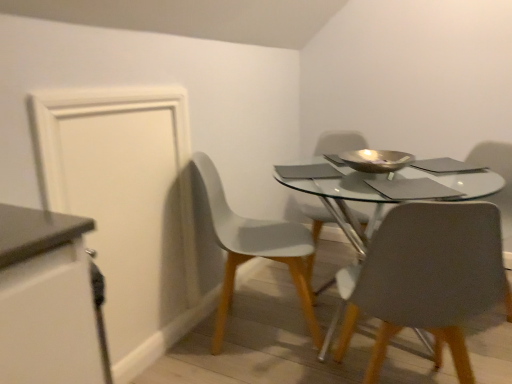
What do you see at coordinates (254, 249) in the screenshot?
I see `white matte chair at lower left, which appears as the second chair when viewed from the back` at bounding box center [254, 249].

Describe the element at coordinates (46, 300) in the screenshot. Image resolution: width=512 pixels, height=384 pixels. I see `white matte cabinet at left` at that location.

This screenshot has width=512, height=384. I want to click on white matte cabinet at left, so [46, 300].

Identify the location of white matte door at left. This screenshot has height=384, width=512. (125, 201).

Describe the element at coordinates (125, 201) in the screenshot. Image resolution: width=512 pixels, height=384 pixels. I see `white matte door at left` at that location.

Find the location of a particular element. The image size is (512, 384). metallic gold bowl at center is located at coordinates (376, 160).

Which of these two, white matte chair at lower left, the second chair when ordered from front to back, or white matte cabinet at left, is bigger?

white matte chair at lower left, the second chair when ordered from front to back.

Could you tell me if white matte chair at lower left, the second chair when ordered from front to back, is turned towards white matte cabinet at left?

No, white matte chair at lower left, the second chair when ordered from front to back, is not turned towards white matte cabinet at left.

Consider the image. Is white matte chair at lower left, which appears as the second chair when viewed from the back, wider or thinner than white matte cabinet at left?

Considering their sizes, white matte chair at lower left, which appears as the second chair when viewed from the back, looks broader than white matte cabinet at left.

In terms of size, does white matte door at left appear bigger or smaller than matte gray chair at center, the 1th chair viewed from the front?

white matte door at left is smaller than matte gray chair at center, the 1th chair viewed from the front.

Is white matte door at left completely or partially outside of matte gray chair at center, the 1th chair viewed from the front?

Yes, white matte door at left is outside of matte gray chair at center, the 1th chair viewed from the front.

From the image's perspective, starting from the white matte door at left, which chair is the 2nd one below? Please provide its 2D coordinates.

[(429, 278)]

From a real-world perspective, is white matte door at left located higher than matte gray chair at center, the 1th chair viewed from the front?

Yes, from a real-world perspective, white matte door at left is over matte gray chair at center, the 1th chair viewed from the front

Which point is more forward, (383, 171) or (219, 245)?

The point (383, 171) is in front.

Who is smaller, metallic gold bowl at center or white matte chair at lower left, the second chair when ordered from front to back?

Smaller between the two is metallic gold bowl at center.

Which of these two, metallic gold bowl at center or white matte chair at lower left, the second chair when ordered from front to back, is thinner?

metallic gold bowl at center is thinner.

Does matte gray chair at center, marked as the 3th chair in a front-to-back arrangement, lie in front of metallic gold bowl at center?

No, matte gray chair at center, marked as the 3th chair in a front-to-back arrangement, is further to the viewer.

Could metallic gold bowl at center be considered to be inside matte gray chair at center, which is counted as the 1th chair, starting from the back?

No, metallic gold bowl at center is located outside of matte gray chair at center, which is counted as the 1th chair, starting from the back.

In order to click on bowl above the matte gray chair at center, which is counted as the 1th chair, starting from the back (from a real-world perspective) in this screenshot , I will do `click(376, 160)`.

Is white matte cabinet at left not near white matte door at left?

No, white matte cabinet at left is in close proximity to white matte door at left.

Can you confirm if white matte cabinet at left is bigger than white matte door at left?

Actually, white matte cabinet at left might be smaller than white matte door at left.

Does white matte cabinet at left have a lesser height compared to white matte door at left?

Indeed, white matte cabinet at left has a lesser height compared to white matte door at left.

Do you think white matte cabinet at left is within white matte door at left, or outside of it?

white matte cabinet at left is not inside white matte door at left, it's outside.

Is white matte chair at lower left, the second chair when ordered from front to back, thinner than matte gray chair at center, acting as the 3th chair starting from the back?

Incorrect, the width of white matte chair at lower left, the second chair when ordered from front to back, is not less than that of matte gray chair at center, acting as the 3th chair starting from the back.

Is white matte chair at lower left, the second chair when ordered from front to back, inside or outside of matte gray chair at center, the 1th chair viewed from the front?

white matte chair at lower left, the second chair when ordered from front to back, is not inside matte gray chair at center, the 1th chair viewed from the front, it's outside.

Is white matte chair at lower left, the second chair when ordered from front to back, beside matte gray chair at center, the 1th chair viewed from the front?

There is a gap between white matte chair at lower left, the second chair when ordered from front to back, and matte gray chair at center, the 1th chair viewed from the front.

From a real-world perspective, which object rests below the other?

matte gray chair at center, the 1th chair viewed from the front, is physically lower.

Is matte gray chair at center, acting as the 3th chair starting from the back, oriented towards white matte cabinet at left?

No, matte gray chair at center, acting as the 3th chair starting from the back, is not facing towards white matte cabinet at left.

Which chair is the 3rd one when counting from the right side of the white matte cabinet at left? Please provide its 2D coordinates.

[(429, 278)]

From a real-world perspective, does matte gray chair at center, the 1th chair viewed from the front, sit lower than white matte cabinet at left?

Yes, from a real-world perspective, matte gray chair at center, the 1th chair viewed from the front, is below white matte cabinet at left.

From a real-world perspective, starting from the white matte cabinet at left, which chair is the 1st one vertically above it? Please provide its 2D coordinates.

[(254, 249)]

Locate an element on the screen. Image resolution: width=512 pixels, height=384 pixels. door on the left of matte gray chair at center, the 1th chair viewed from the front is located at coordinates (125, 201).

When comparing their distances from matte gray chair at center, the 1th chair viewed from the front, does matte gray chair at center, which is counted as the 1th chair, starting from the back, or white matte cabinet at left seem closer?

white matte cabinet at left.

Which object lies further to the anchor point white matte door at left, metallic gold bowl at center or white matte cabinet at left?

metallic gold bowl at center.

Looking at the image, which one is located further to white matte chair at lower left, the second chair when ordered from front to back, white matte cabinet at left or matte gray chair at center, which is counted as the 1th chair, starting from the back?

white matte cabinet at left is further to white matte chair at lower left, the second chair when ordered from front to back.

When comparing their distances from white matte door at left, does matte gray chair at center, marked as the 3th chair in a front-to-back arrangement, or matte gray chair at center, the 1th chair viewed from the front, seem closer?

matte gray chair at center, the 1th chair viewed from the front, lies closer to white matte door at left than the other object.

Looking at the image, which one is located closer to white matte cabinet at left, matte gray chair at center, marked as the 3th chair in a front-to-back arrangement, or metallic gold bowl at center?

Among the two, metallic gold bowl at center is located nearer to white matte cabinet at left.

Estimate the real-world distances between objects in this image. Which object is closer to matte gray chair at center, which is counted as the 1th chair, starting from the back, metallic gold bowl at center or white matte cabinet at left?

Answer: The object closer to matte gray chair at center, which is counted as the 1th chair, starting from the back, is metallic gold bowl at center.

When comparing their distances from white matte door at left, does metallic gold bowl at center or white matte chair at lower left, the second chair when ordered from front to back, seem closer?

white matte chair at lower left, the second chair when ordered from front to back, is closer to white matte door at left.

Looking at the image, which one is located closer to white matte door at left, white matte cabinet at left or matte gray chair at center, marked as the 3th chair in a front-to-back arrangement?

white matte cabinet at left is closer to white matte door at left.

Find the location of a particular element. The height and width of the screenshot is (384, 512). cabinetry between matte gray chair at center, acting as the 3th chair starting from the back, and matte gray chair at center, which is counted as the 1th chair, starting from the back, along the z-axis is located at coordinates (46, 300).

What are the coordinates of `chair located between matte gray chair at center, the 1th chair viewed from the front, and matte gray chair at center, marked as the 3th chair in a front-to-back arrangement, in the depth direction` in the screenshot? It's located at (254, 249).

Locate an element on the screen. chair between white matte cabinet at left and matte gray chair at center, which is counted as the 1th chair, starting from the back, from front to back is located at coordinates (254, 249).

Find the location of a particular element. The width and height of the screenshot is (512, 384). door located between white matte cabinet at left and matte gray chair at center, marked as the 3th chair in a front-to-back arrangement, in the left-right direction is located at coordinates (125, 201).